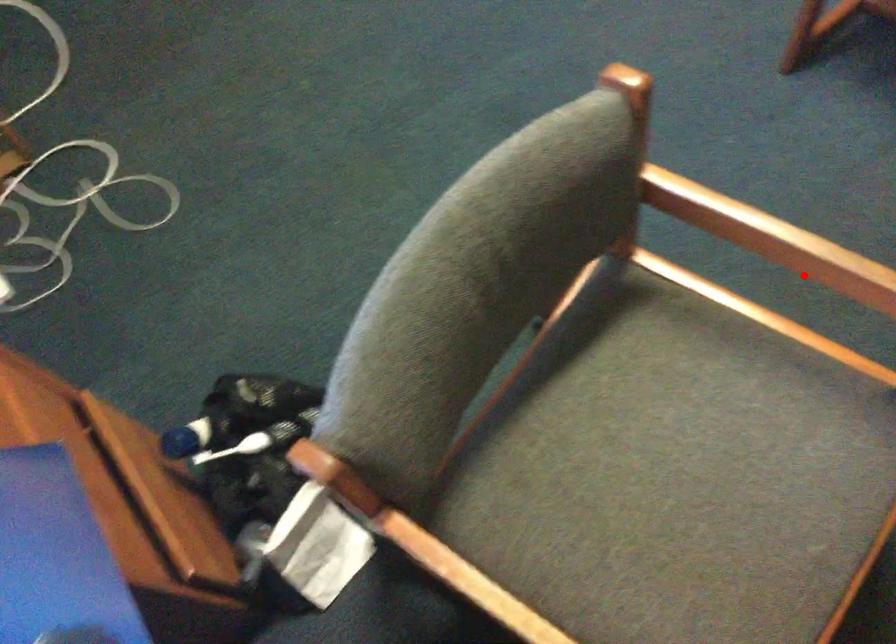
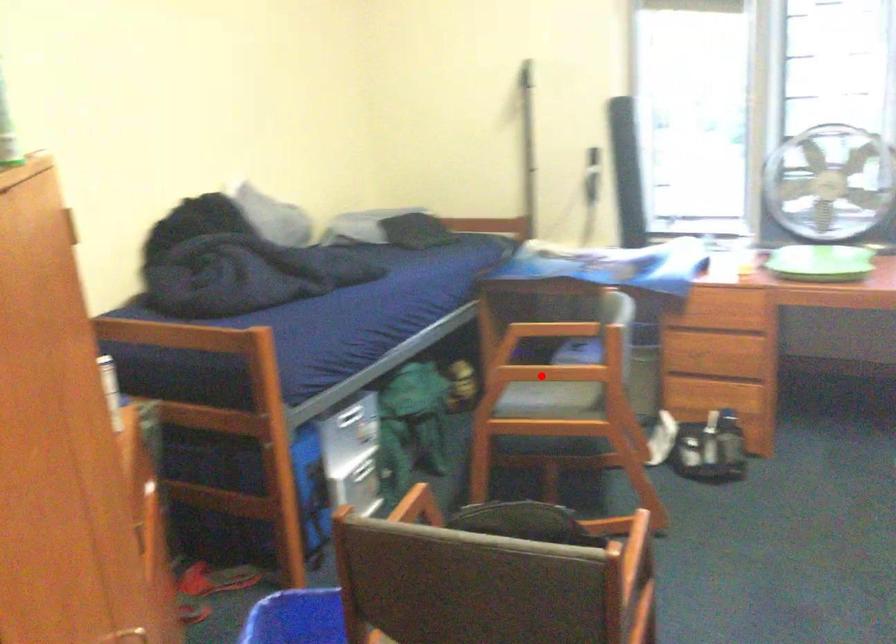
I am providing you with two images of the same scene from different viewpoints. A red point is marked on the first image and another point is marked on the second image. Is the marked point in image1 the same physical position as the marked point in image2?

Yes